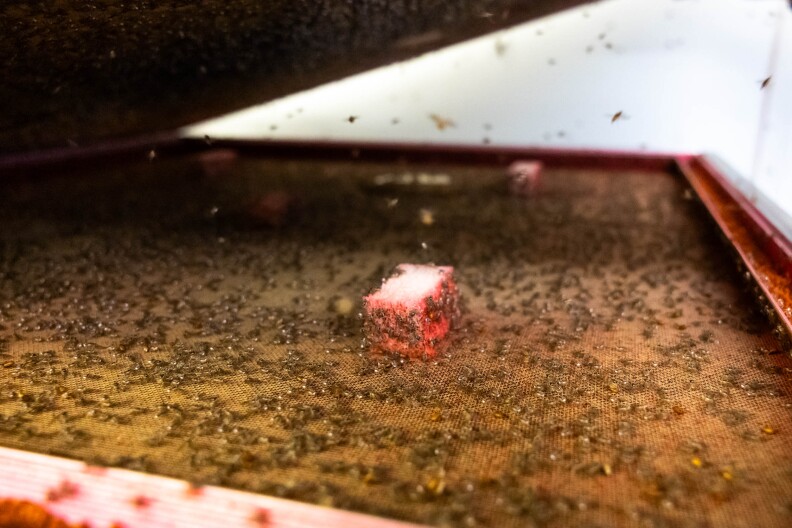
Image resolution: width=792 pixels, height=528 pixels. Identify the location of white wall. (775, 163).